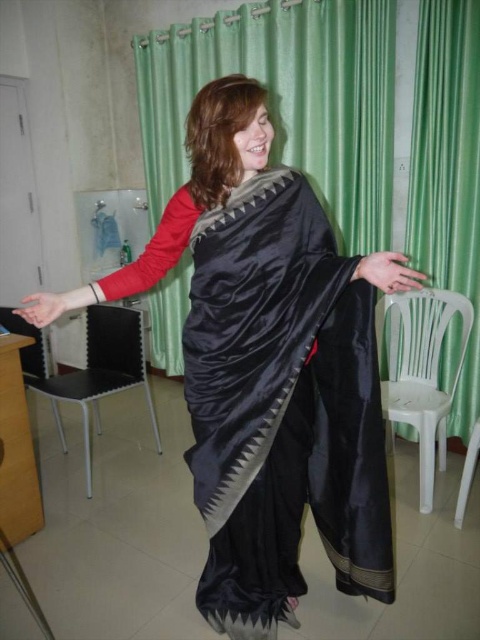
Can you confirm if satin black sari at center is positioned to the left of green satin curtain at right?

Correct, you'll find satin black sari at center to the left of green satin curtain at right.

Between satin black sari at center and green satin curtain at right, which one has less height?

satin black sari at center

This screenshot has height=640, width=480. I want to click on satin black sari at center, so click(267, 369).

Looking at this image, does satin black sari at center appear over satin black dress at center?

Indeed, satin black sari at center is positioned over satin black dress at center.

Between satin black sari at center and satin black dress at center, which one is positioned lower?

satin black dress at center is lower down.

Does point (346, 296) come farther from viewer compared to point (313, 362)?

No, it is not.

Where is `satin black sari at center`? The image size is (480, 640). satin black sari at center is located at coordinates (267, 369).

Does green satin curtain at upper center appear on the right side of white plastic chair at right?

In fact, green satin curtain at upper center is to the left of white plastic chair at right.

Where is `green satin curtain at upper center`? The width and height of the screenshot is (480, 640). green satin curtain at upper center is located at coordinates (287, 100).

The image size is (480, 640). Find the location of `green satin curtain at upper center`. green satin curtain at upper center is located at coordinates (287, 100).